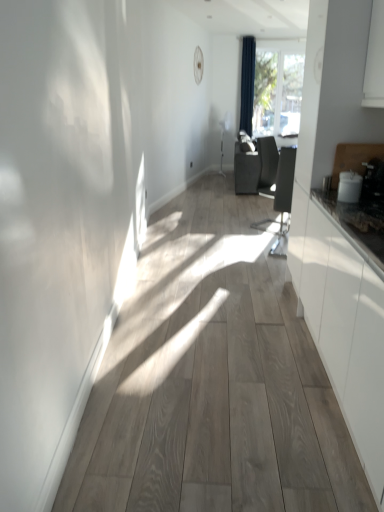
Describe the element at coordinates (278, 87) in the screenshot. I see `transparent glass window at upper center` at that location.

At what (x,y) coordinates should I click in order to perform the action: click on matte black swivel chair at center. Please return your answer as a coordinate pair (x, y). The width and height of the screenshot is (384, 512). Looking at the image, I should click on (282, 197).

The width and height of the screenshot is (384, 512). What are the coordinates of `transparent glass window at upper center` in the screenshot? It's located at (278, 87).

Is matte black swivel chair at center spatially inside dark blue fabric curtain at upper center, or outside of it?

matte black swivel chair at center is outside dark blue fabric curtain at upper center.

From the image's perspective, is matte black swivel chair at center positioned above or below dark blue fabric curtain at upper center?

Clearly, from the image's perspective, matte black swivel chair at center is below dark blue fabric curtain at upper center.

Relative to dark blue fabric curtain at upper center, is matte black swivel chair at center in front or behind?

In the image, matte black swivel chair at center appears in front of dark blue fabric curtain at upper center.

Considering the sizes of objects matte black swivel chair at center and dark blue fabric curtain at upper center in the image provided, who is thinner, matte black swivel chair at center or dark blue fabric curtain at upper center?

dark blue fabric curtain at upper center is thinner.

From the image's perspective, between matte black swivel chair at center and transparent glass window at upper center, who is located below?

matte black swivel chair at center, from the image's perspective.

Is transparent glass window at upper center a part of matte black swivel chair at center?

No, transparent glass window at upper center is not inside matte black swivel chair at center.

Which is more to the right, matte black swivel chair at center or transparent glass window at upper center?

Positioned to the right is transparent glass window at upper center.

Locate an element on the screen. This screenshot has height=512, width=384. swivel chair below the transparent glass window at upper center (from a real-world perspective) is located at coordinates (282, 197).

Is transparent glass window at upper center touching matte black swivel chair at center?

No, transparent glass window at upper center is not making contact with matte black swivel chair at center.

Is transparent glass window at upper center inside the boundaries of matte black swivel chair at center, or outside?

transparent glass window at upper center lies outside matte black swivel chair at center.

Based on the photo, is transparent glass window at upper center aimed at matte black swivel chair at center?

Yes, transparent glass window at upper center is oriented towards matte black swivel chair at center.

From the picture: Does dark blue fabric curtain at upper center touch transparent glass window at upper center?

There is a gap between dark blue fabric curtain at upper center and transparent glass window at upper center.

From a real-world perspective, does dark blue fabric curtain at upper center stand above transparent glass window at upper center?

Yes.

Image resolution: width=384 pixels, height=512 pixels. Find the location of `window above the dark blue fabric curtain at upper center (from the image's perspective)`. window above the dark blue fabric curtain at upper center (from the image's perspective) is located at coordinates (278, 87).

Is transparent glass window at upper center spatially inside dark blue fabric curtain at upper center, or outside of it?

transparent glass window at upper center is spatially situated outside dark blue fabric curtain at upper center.

Is transparent glass window at upper center to the left of dark blue fabric curtain at upper center from the viewer's perspective?

No.

How far apart are transparent glass window at upper center and dark blue fabric curtain at upper center?

transparent glass window at upper center and dark blue fabric curtain at upper center are 18.43 inches apart.

Are transparent glass window at upper center and dark blue fabric curtain at upper center making contact?

No, transparent glass window at upper center is not in contact with dark blue fabric curtain at upper center.

Consider the image. Is dark blue fabric curtain at upper center oriented towards matte black swivel chair at center?

Yes, dark blue fabric curtain at upper center is oriented towards matte black swivel chair at center.

Relative to matte black swivel chair at center, is dark blue fabric curtain at upper center in front or behind?

dark blue fabric curtain at upper center is positioned farther from the viewer than matte black swivel chair at center.

Is point (246, 127) positioned behind point (282, 230)?

Yes, it is.

From the picture: Considering the sizes of objects dark blue fabric curtain at upper center and matte black swivel chair at center in the image provided, who is wider, dark blue fabric curtain at upper center or matte black swivel chair at center?

matte black swivel chair at center is wider.

I want to click on swivel chair in front of the dark blue fabric curtain at upper center, so click(282, 197).

You are a GUI agent. You are given a task and a screenshot of the screen. Output one action in this format:
    pyautogui.click(x=<x>, y=<y>)
    Task: Click on the swivel chair below the transparent glass window at upper center (from a real-world perspective)
    The width and height of the screenshot is (384, 512).
    Given the screenshot: What is the action you would take?
    pyautogui.click(x=282, y=197)

Considering their positions, is transparent glass window at upper center positioned closer to dark blue fabric curtain at upper center than matte black swivel chair at center?

transparent glass window at upper center lies closer to dark blue fabric curtain at upper center than the other object.

From the picture: When comparing their distances from transparent glass window at upper center, does dark blue fabric curtain at upper center or matte black swivel chair at center seem further?

The object further to transparent glass window at upper center is matte black swivel chair at center.

From the image, which object appears to be farther from matte black swivel chair at center, transparent glass window at upper center or dark blue fabric curtain at upper center?

transparent glass window at upper center is positioned further to the anchor matte black swivel chair at center.

Estimate the real-world distances between objects in this image. Which object is closer to transparent glass window at upper center, matte black swivel chair at center or dark blue fabric curtain at upper center?

Based on the image, dark blue fabric curtain at upper center appears to be nearer to transparent glass window at upper center.

Considering their positions, is matte black swivel chair at center positioned closer to dark blue fabric curtain at upper center than transparent glass window at upper center?

transparent glass window at upper center is positioned closer to the anchor dark blue fabric curtain at upper center.

From the picture: Looking at the image, which one is located closer to matte black swivel chair at center, dark blue fabric curtain at upper center or transparent glass window at upper center?

Based on the image, dark blue fabric curtain at upper center appears to be nearer to matte black swivel chair at center.

This screenshot has width=384, height=512. I want to click on curtain between matte black swivel chair at center and transparent glass window at upper center from front to back, so click(x=247, y=83).